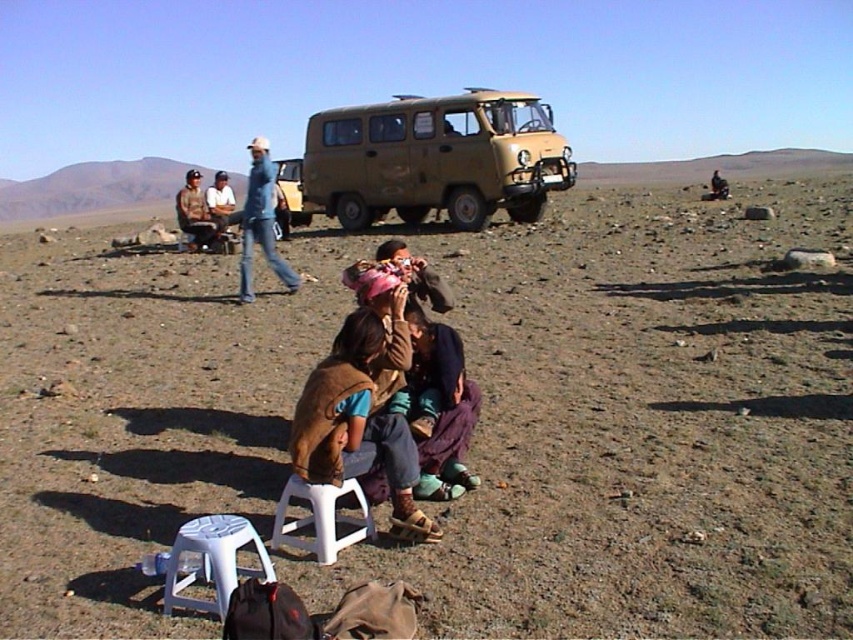
You are planning to sit on the ground in the arid landscape scene. You see the jeans at center and the brown leather jacket at center. Which item would allow you to sit more comfortably considering their size?

The brown leather jacket at center would allow more comfortable sitting because it has a greater width than the jeans at center, providing a larger surface area for cushioning.